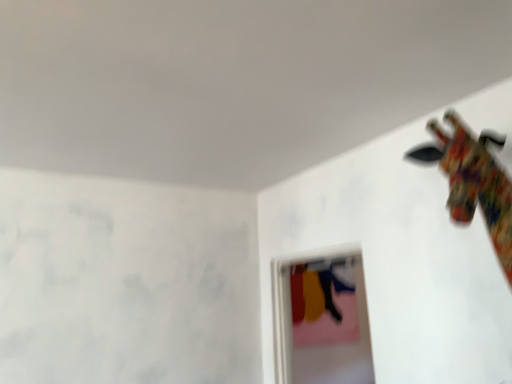
Describe the element at coordinates (473, 182) in the screenshot. This screenshot has height=384, width=512. I see `multicolored fabric giraffe at upper right` at that location.

Find the location of a particular element. This screenshot has height=384, width=512. multicolored fabric giraffe at upper right is located at coordinates (473, 182).

Measure the distance between point (496, 165) and camera.

A distance of 1.49 meters exists between point (496, 165) and camera.

Locate an element on the screen. This screenshot has height=384, width=512. multicolored fabric giraffe at upper right is located at coordinates (473, 182).